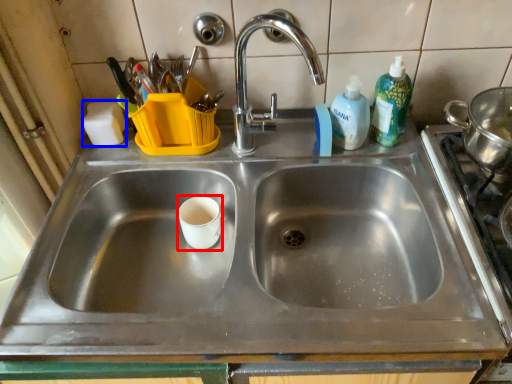
Question: Which object is further to the camera taking this photo, paper cup (highlighted by a red box) or soap (highlighted by a blue box)?

Choices:
 (A) paper cup
 (B) soap

Answer: (B)